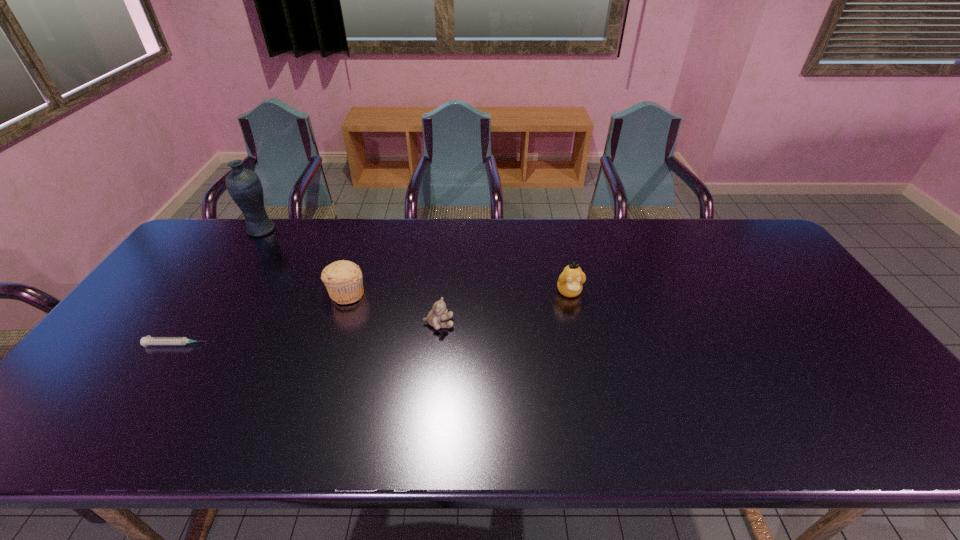
Identify the location of vacant area at the near right corner of the desktop. This screenshot has width=960, height=540. (916, 440).

This screenshot has height=540, width=960. I want to click on empty location between the vase and the muffin, so click(x=304, y=262).

Find the location of a particular element. The image size is (960, 540). unoccupied position between the rightmost object and the syringe is located at coordinates (373, 318).

This screenshot has height=540, width=960. Find the location of `vacant space that's between the muffin and the fourth farthest object`. vacant space that's between the muffin and the fourth farthest object is located at coordinates (393, 308).

Identify the location of free space between the third object from left to right and the shortest object. click(x=262, y=319).

The width and height of the screenshot is (960, 540). I want to click on vacant area that lies between the syringe and the duckling, so click(373, 318).

In order to click on free space between the third object from left to right and the nearest object in this screenshot , I will do `click(262, 319)`.

The width and height of the screenshot is (960, 540). In order to click on vacant space that's between the tallest object and the muffin in this screenshot , I will do `click(304, 262)`.

The height and width of the screenshot is (540, 960). Identify the location of free area in between the muffin and the duckling. (458, 293).

The height and width of the screenshot is (540, 960). Find the location of `vacant area between the tallest object and the syringe`. vacant area between the tallest object and the syringe is located at coordinates (219, 287).